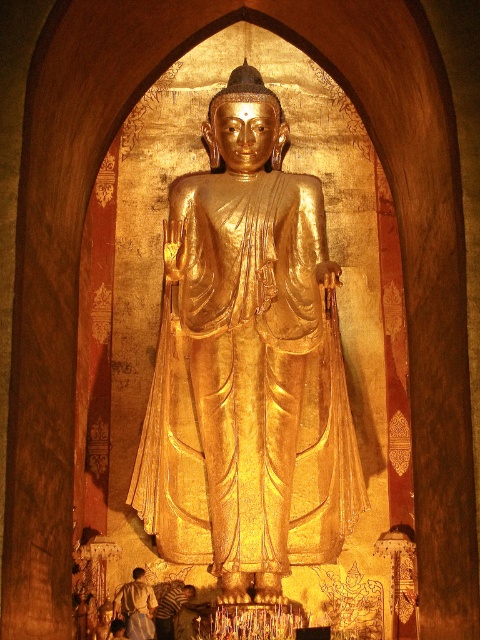
You are a tour guide explaining the temple layout to visitors. You mention the gold polished statue at center and the white cloth at lower left. How far apart are these two items in meters?

The distance between the gold polished statue at center and the white cloth at lower left is 18.55 meters.